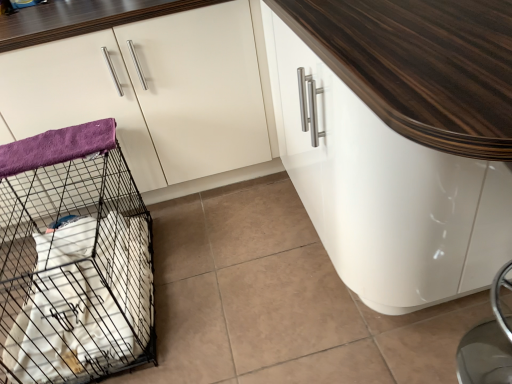
Find the location of a particular element. This screenshot has width=512, height=384. black wire mesh cage at left is located at coordinates (72, 259).

Where is `white glossy cabinet at center, which is counted as the first cabinetry, starting from the right`? The image size is (512, 384). white glossy cabinet at center, which is counted as the first cabinetry, starting from the right is located at coordinates (384, 190).

The image size is (512, 384). Describe the element at coordinates (384, 190) in the screenshot. I see `white glossy cabinet at center, which is counted as the first cabinetry, starting from the right` at that location.

What do you see at coordinates (154, 92) in the screenshot? The width and height of the screenshot is (512, 384). I see `white glossy cabinet at upper left, positioned as the 1th cabinetry in left-to-right order` at bounding box center [154, 92].

Locate an element on the screen. This screenshot has width=512, height=384. black wire mesh cage at left is located at coordinates (72, 259).

Considering the points (131, 168) and (94, 131), which point is behind, point (131, 168) or point (94, 131)?

The point (131, 168) is farther.

Between white glossy cabinet at upper left, arranged as the 2th cabinetry when viewed from the right, and purple fleece blanket at left, which one has smaller width?

purple fleece blanket at left.

Locate an element on the screen. The height and width of the screenshot is (384, 512). blanket behind the white glossy cabinet at upper left, arranged as the 2th cabinetry when viewed from the right is located at coordinates (57, 147).

Can you tell me how much black wire mesh cage at left and white glossy cabinet at upper left, arranged as the 2th cabinetry when viewed from the right, differ in facing direction?

black wire mesh cage at left and white glossy cabinet at upper left, arranged as the 2th cabinetry when viewed from the right, are facing 88.9 degrees away from each other.

Which object is positioned more to the right, black wire mesh cage at left or white glossy cabinet at upper left, positioned as the 1th cabinetry in left-to-right order?

Positioned to the right is white glossy cabinet at upper left, positioned as the 1th cabinetry in left-to-right order.

Between point (62, 270) and point (167, 119), which one is positioned in front?

Positioned in front is point (62, 270).

Between black wire mesh cage at left and white glossy cabinet at upper left, arranged as the 2th cabinetry when viewed from the right, which one has smaller width?

With smaller width is black wire mesh cage at left.

From the picture: Would you say purple fleece blanket at left is outside white glossy cabinet at upper left, positioned as the 1th cabinetry in left-to-right order?

Yes, purple fleece blanket at left is outside of white glossy cabinet at upper left, positioned as the 1th cabinetry in left-to-right order.

Is purple fleece blanket at left beside white glossy cabinet at upper left, arranged as the 2th cabinetry when viewed from the right?

purple fleece blanket at left is not next to white glossy cabinet at upper left, arranged as the 2th cabinetry when viewed from the right, and they're not touching.

From the image's perspective, is purple fleece blanket at left located above or below white glossy cabinet at upper left, arranged as the 2th cabinetry when viewed from the right?

purple fleece blanket at left is situated lower than white glossy cabinet at upper left, arranged as the 2th cabinetry when viewed from the right, in the image.

Is purple fleece blanket at left oriented towards white glossy cabinet at upper left, arranged as the 2th cabinetry when viewed from the right?

No, purple fleece blanket at left is not oriented towards white glossy cabinet at upper left, arranged as the 2th cabinetry when viewed from the right.

From the picture: Can you confirm if purple fleece blanket at left is positioned to the right of white glossy cabinet at center, the 2th cabinetry viewed from the left?

No.

Is purple fleece blanket at left positioned in front of white glossy cabinet at center, which is counted as the first cabinetry, starting from the right?

That is False.

Which object is thinner, purple fleece blanket at left or white glossy cabinet at center, the 2th cabinetry viewed from the left?

purple fleece blanket at left is thinner.

Is white glossy cabinet at center, the 2th cabinetry viewed from the left, located within purple fleece blanket at left?

Actually, white glossy cabinet at center, the 2th cabinetry viewed from the left, is outside purple fleece blanket at left.

In the scene shown: Considering the relative sizes of white glossy cabinet at upper left, positioned as the 1th cabinetry in left-to-right order, and white glossy cabinet at center, the 2th cabinetry viewed from the left, in the image provided, is white glossy cabinet at upper left, positioned as the 1th cabinetry in left-to-right order, bigger than white glossy cabinet at center, the 2th cabinetry viewed from the left,?

No, white glossy cabinet at upper left, positioned as the 1th cabinetry in left-to-right order, is not bigger than white glossy cabinet at center, the 2th cabinetry viewed from the left.

Considering the positions of point (239, 22) and point (292, 77), is point (239, 22) closer or farther from the camera than point (292, 77)?

Point (239, 22) is farther from the camera than point (292, 77).

In the scene shown: Is white glossy cabinet at center, the 2th cabinetry viewed from the left, at the back of white glossy cabinet at upper left, arranged as the 2th cabinetry when viewed from the right?

No, white glossy cabinet at upper left, arranged as the 2th cabinetry when viewed from the right, is not facing away from white glossy cabinet at center, the 2th cabinetry viewed from the left.

Consider the image. Is white glossy cabinet at upper left, positioned as the 1th cabinetry in left-to-right order, in front of or behind white glossy cabinet at center, the 2th cabinetry viewed from the left, in the image?

Clearly, white glossy cabinet at upper left, positioned as the 1th cabinetry in left-to-right order, is behind white glossy cabinet at center, the 2th cabinetry viewed from the left.

Is black wire mesh cage at left a part of purple fleece blanket at left?

No, black wire mesh cage at left is located outside of purple fleece blanket at left.

Is purple fleece blanket at left with black wire mesh cage at left?

No, purple fleece blanket at left is not in contact with black wire mesh cage at left.

Which object is further away from the camera, purple fleece blanket at left or black wire mesh cage at left?

purple fleece blanket at left is behind.

Which is further, (39, 159) or (79, 174)?

The point (79, 174) is behind.

From a real-world perspective, is black wire mesh cage at left on white glossy cabinet at center, the 2th cabinetry viewed from the left?

Actually, black wire mesh cage at left is physically below white glossy cabinet at center, the 2th cabinetry viewed from the left, in the real world.

Looking at this image, based on their sizes in the image, would you say black wire mesh cage at left is bigger or smaller than white glossy cabinet at center, which is counted as the first cabinetry, starting from the right?

In the image, black wire mesh cage at left appears to be smaller than white glossy cabinet at center, which is counted as the first cabinetry, starting from the right.

How much distance is there between black wire mesh cage at left and white glossy cabinet at center, the 2th cabinetry viewed from the left?

black wire mesh cage at left and white glossy cabinet at center, the 2th cabinetry viewed from the left, are 36.37 inches apart from each other.

Identify the location of blanket below the white glossy cabinet at upper left, positioned as the 1th cabinetry in left-to-right order (from the image's perspective). The width and height of the screenshot is (512, 384). coord(57,147).

The height and width of the screenshot is (384, 512). Find the location of `cabinetry behind the black wire mesh cage at left`. cabinetry behind the black wire mesh cage at left is located at coordinates (154, 92).

When comparing their distances from purple fleece blanket at left, does white glossy cabinet at center, which is counted as the first cabinetry, starting from the right, or black wire mesh cage at left seem further?

white glossy cabinet at center, which is counted as the first cabinetry, starting from the right, lies further to purple fleece blanket at left than the other object.

Based on their spatial positions, is white glossy cabinet at upper left, positioned as the 1th cabinetry in left-to-right order, or purple fleece blanket at left further from black wire mesh cage at left?

white glossy cabinet at upper left, positioned as the 1th cabinetry in left-to-right order, is positioned further to the anchor black wire mesh cage at left.

When comparing their distances from white glossy cabinet at center, the 2th cabinetry viewed from the left, does black wire mesh cage at left or purple fleece blanket at left seem further?

black wire mesh cage at left lies further to white glossy cabinet at center, the 2th cabinetry viewed from the left, than the other object.

Based on their spatial positions, is white glossy cabinet at center, which is counted as the first cabinetry, starting from the right, or black wire mesh cage at left closer to white glossy cabinet at upper left, positioned as the 1th cabinetry in left-to-right order?

The object closer to white glossy cabinet at upper left, positioned as the 1th cabinetry in left-to-right order, is black wire mesh cage at left.

Based on their spatial positions, is white glossy cabinet at center, the 2th cabinetry viewed from the left, or purple fleece blanket at left further from black wire mesh cage at left?

white glossy cabinet at center, the 2th cabinetry viewed from the left, is further to black wire mesh cage at left.

Estimate the real-world distances between objects in this image. Which object is further from purple fleece blanket at left, white glossy cabinet at upper left, positioned as the 1th cabinetry in left-to-right order, or white glossy cabinet at center, which is counted as the first cabinetry, starting from the right?

white glossy cabinet at center, which is counted as the first cabinetry, starting from the right, lies further to purple fleece blanket at left than the other object.

Based on the photo, which object lies nearer to the anchor point white glossy cabinet at upper left, positioned as the 1th cabinetry in left-to-right order, white glossy cabinet at center, which is counted as the first cabinetry, starting from the right, or purple fleece blanket at left?

purple fleece blanket at left.

Based on their spatial positions, is black wire mesh cage at left or white glossy cabinet at center, the 2th cabinetry viewed from the left, further from purple fleece blanket at left?

Among the two, white glossy cabinet at center, the 2th cabinetry viewed from the left, is located further to purple fleece blanket at left.

What are the coordinates of `cabinetry located between black wire mesh cage at left and white glossy cabinet at center, the 2th cabinetry viewed from the left, in the left-right direction` in the screenshot? It's located at (154, 92).

What are the coordinates of `bird cage situated between purple fleece blanket at left and white glossy cabinet at center, the 2th cabinetry viewed from the left, from left to right` in the screenshot? It's located at (72, 259).

The image size is (512, 384). I want to click on blanket between white glossy cabinet at upper left, arranged as the 2th cabinetry when viewed from the right, and black wire mesh cage at left in the up-down direction, so click(57, 147).

Locate an element on the screen. The width and height of the screenshot is (512, 384). cabinetry between purple fleece blanket at left and white glossy cabinet at center, which is counted as the first cabinetry, starting from the right, in the horizontal direction is located at coordinates (154, 92).